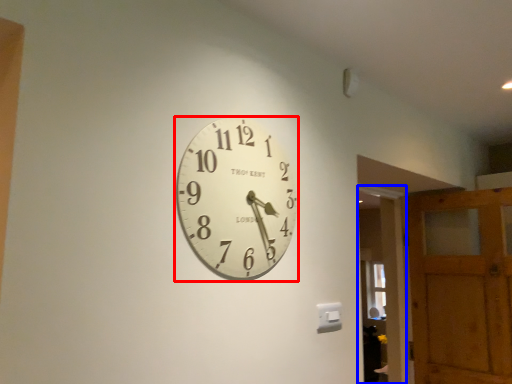
Question: Which point is closer to the camera, wall clock (highlighted by a red box) or glass door (highlighted by a blue box)?

Choices:
 (A) wall clock
 (B) glass door

Answer: (A)